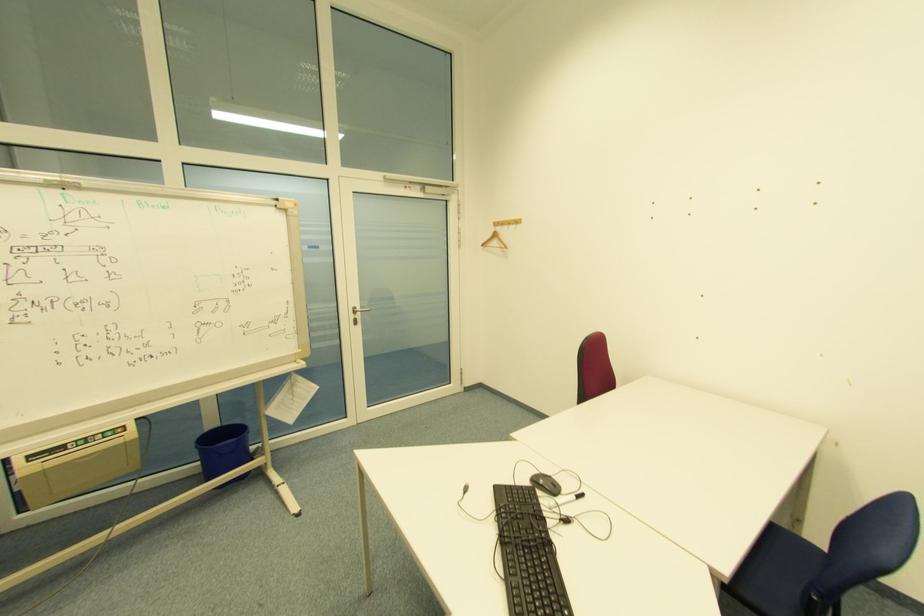
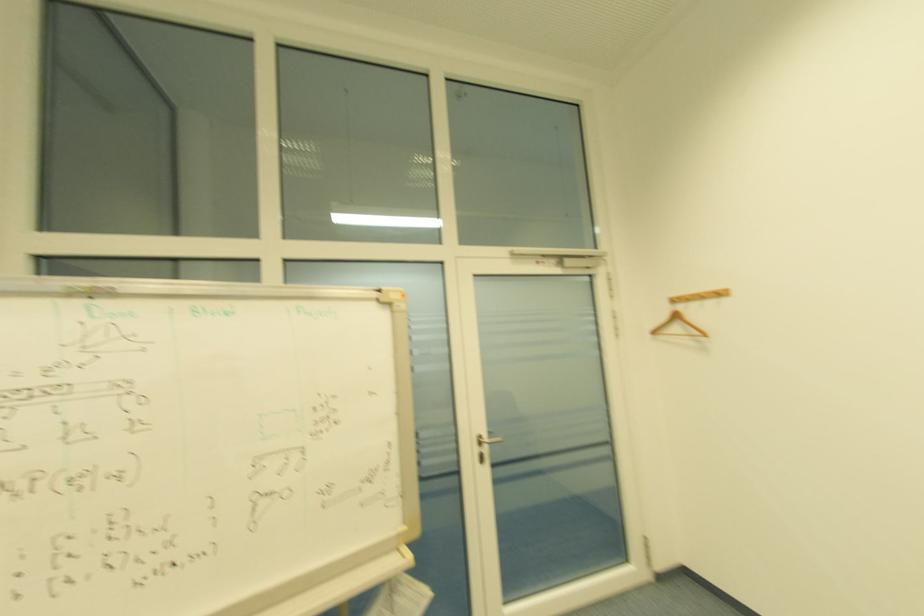
What movement of the cameraman would produce the second image?

The cameraman moved toward left, forward.